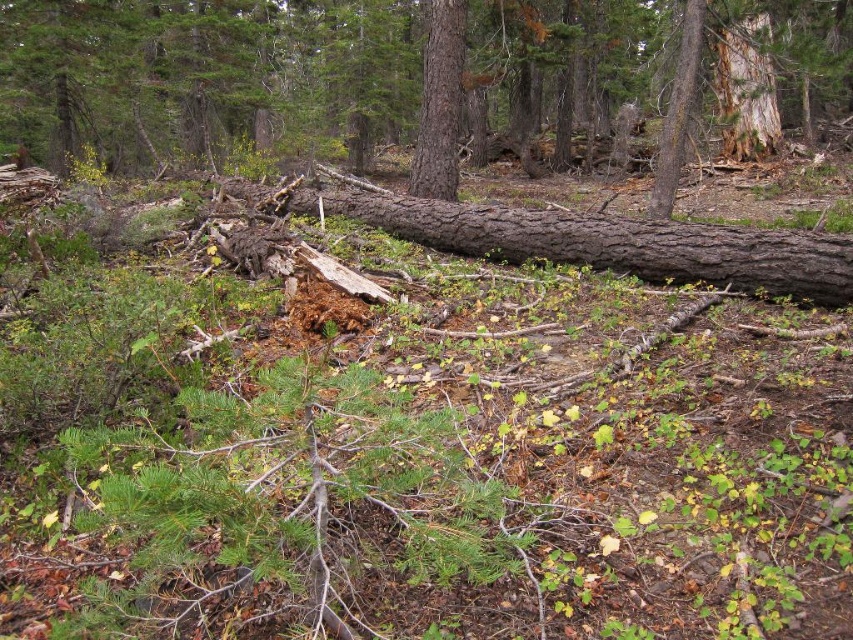
You are a hiker who wants to cross the forest floor. You see the brown rough log at center and the smooth brown tree trunk at center. Which object is farther from your current position?

The brown rough log at center and smooth brown tree trunk at center are 8.18 meters apart, so you cannot determine which is farther without knowing your exact location relative to both.

You are a hiker who has stumbled upon this forest scene. You notice the brown rough log at center and the smooth brown tree trunk at center. Which object is positioned higher relative to the other?

The brown rough log at center is located above the smooth brown tree trunk at center, so it is positioned higher.

You are a hiker trying to cross the forest floor. You see the brown rough log at center and the smooth brown tree trunk at center. Which object is positioned to the right of the other?

The brown rough log at center is positioned to the right of the smooth brown tree trunk at center.